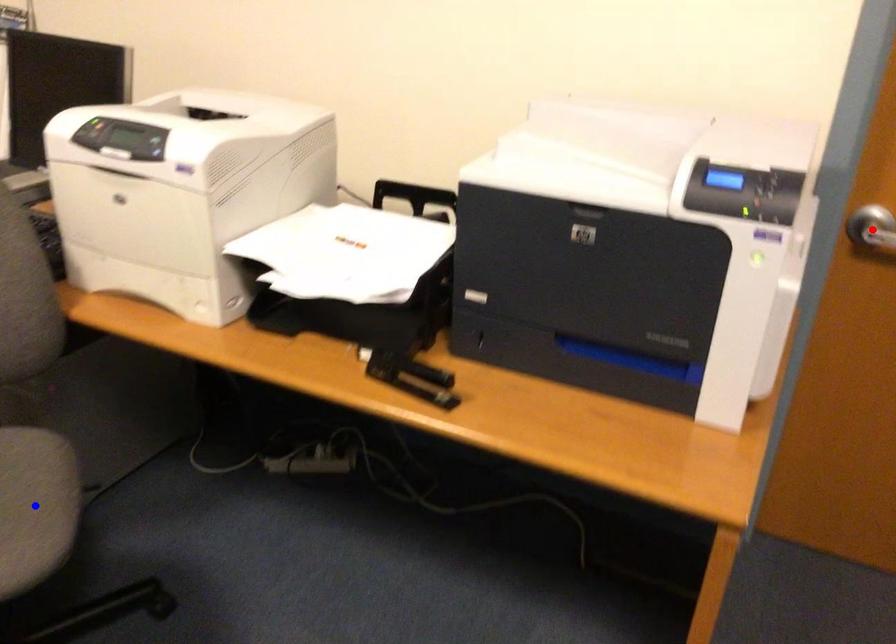
Question: In the image, two points are highlighted. Which point is nearer to the camera? Reply with the corresponding letter.

Choices:
 (A) blue point
 (B) red point

Answer: (A)